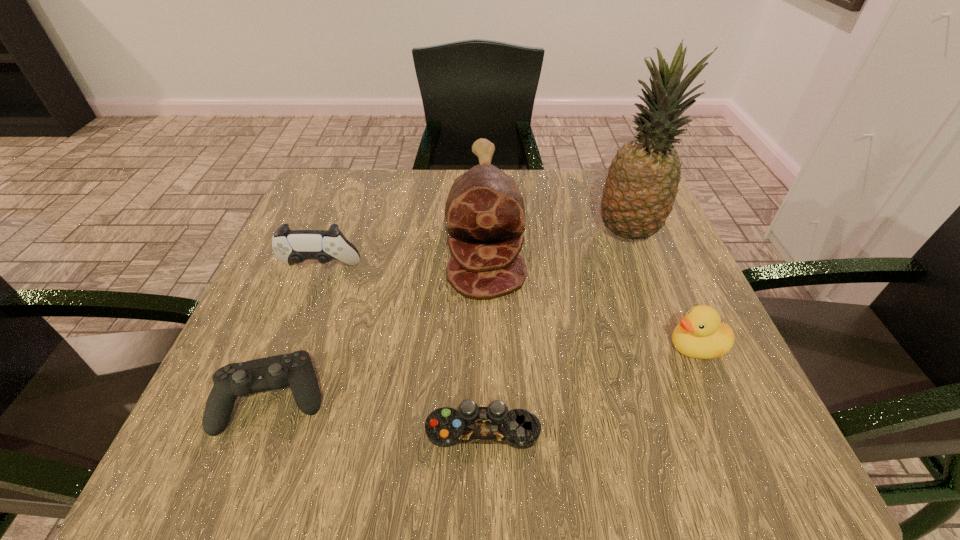
Locate an element on the screen. The width and height of the screenshot is (960, 540). vacant point that satisfies the following two spatial constraints: 1. on the front-facing side of the tallest control; 2. on the right side of the second tallest control is located at coordinates (271, 399).

Locate an element on the screen. This screenshot has height=540, width=960. vacant position in the image that satisfies the following two spatial constraints: 1. on the front-facing side of the farthest control; 2. on the right side of the shortest object is located at coordinates (259, 429).